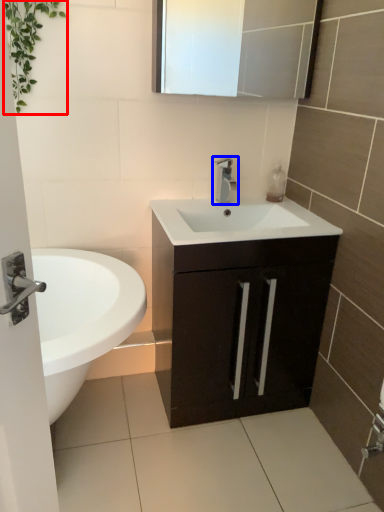
Question: Which object appears farthest to the camera in this image, vegetation (highlighted by a red box) or tap (highlighted by a blue box)?

Choices:
 (A) vegetation
 (B) tap

Answer: (B)